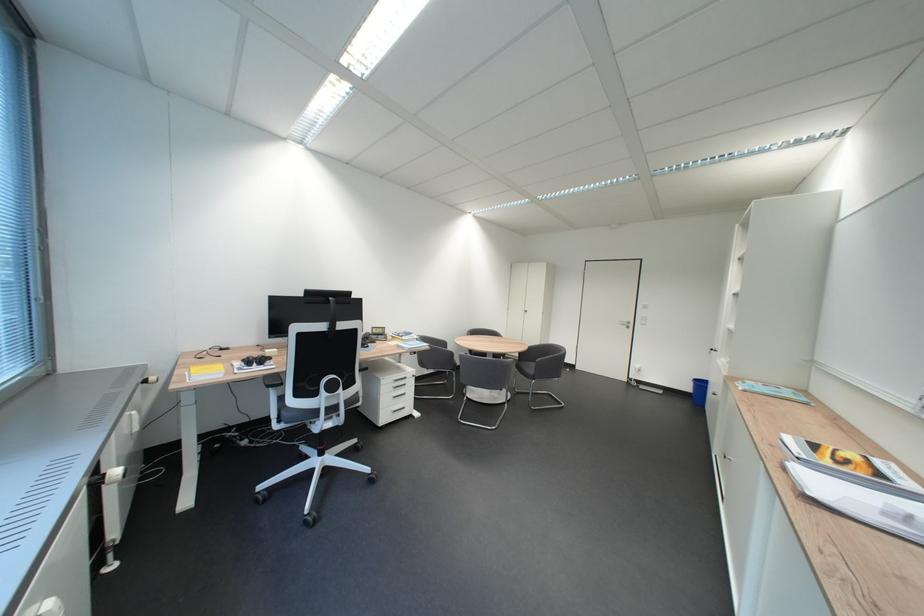
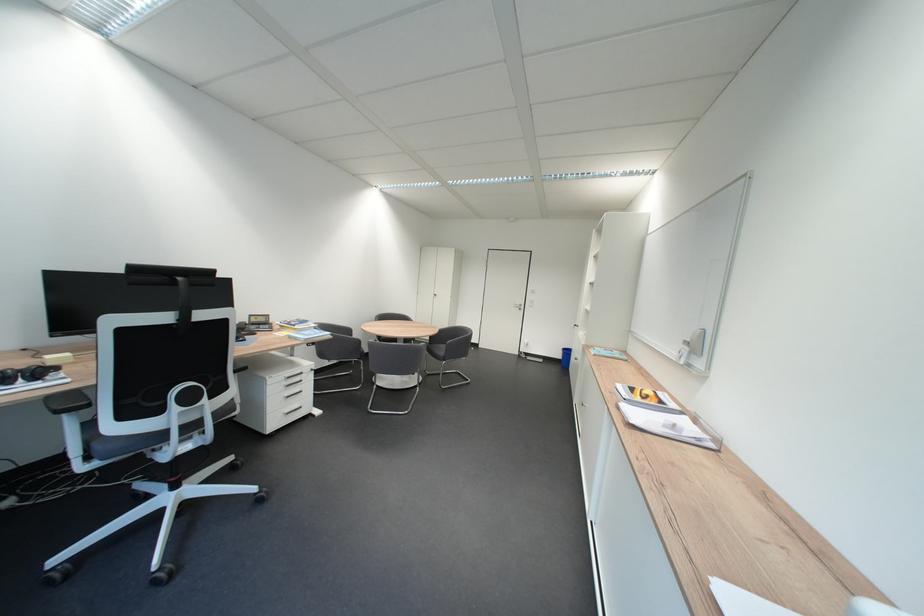
Find the pixel in the second image that matches point 408,382 in the first image.

(300, 379)